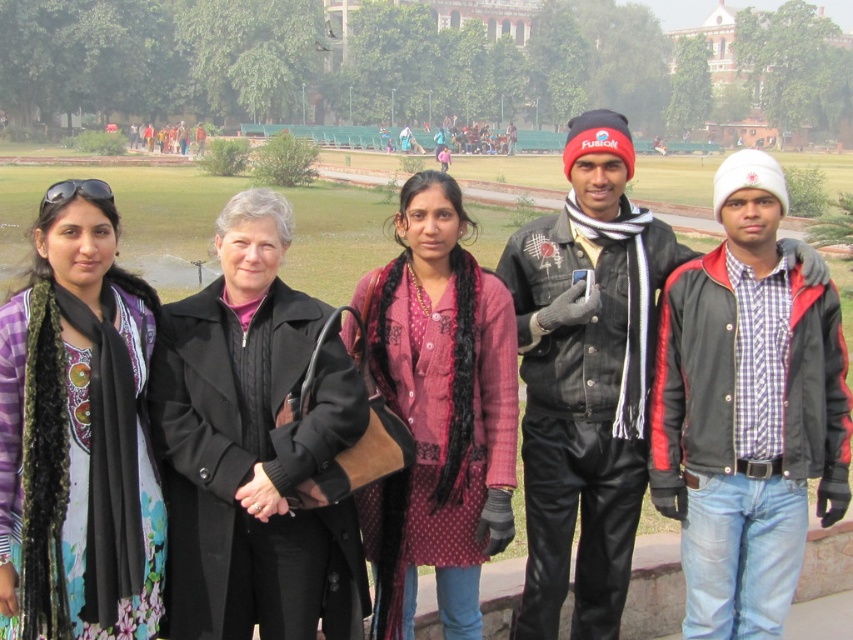
Does printed cotton dress at left have a lesser height compared to rustic cotton kurti at center?

Yes, printed cotton dress at left is shorter than rustic cotton kurti at center.

Can you confirm if printed cotton dress at left is positioned to the left of rustic cotton kurti at center?

Yes, printed cotton dress at left is to the left of rustic cotton kurti at center.

Is point (47, 538) behind point (509, 461)?

No, (47, 538) is closer to viewer.

This screenshot has width=853, height=640. Find the location of `printed cotton dress at left`. printed cotton dress at left is located at coordinates (77, 435).